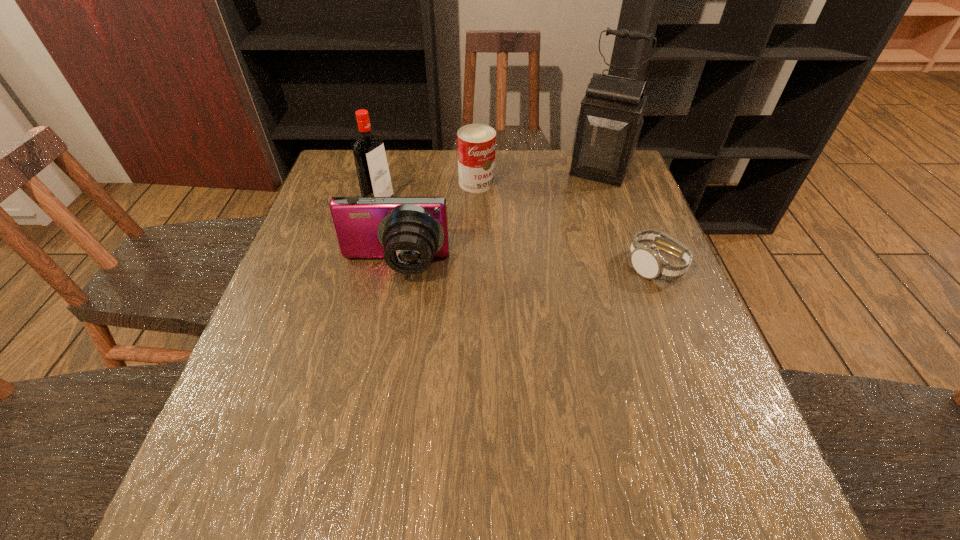
Locate an element on the screen. The width and height of the screenshot is (960, 540). vacant region at the near left corner of the desktop is located at coordinates (264, 434).

Identify the location of free space at the far right corner. Image resolution: width=960 pixels, height=540 pixels. (597, 185).

The height and width of the screenshot is (540, 960). Find the location of `vacant area at the near right corner`. vacant area at the near right corner is located at coordinates (683, 404).

The width and height of the screenshot is (960, 540). I want to click on vacant area between the shortest object and the camera, so click(524, 267).

Locate an element on the screen. The width and height of the screenshot is (960, 540). vacant space that is in between the vodka and the watch is located at coordinates (516, 234).

Find the location of a particular element. Image resolution: width=960 pixels, height=540 pixels. vacant region between the third nearest object and the third object from left to right is located at coordinates (428, 192).

Identify the location of vacant area between the can and the tallest object. pyautogui.click(x=539, y=177).

Identify the location of free spot between the tallest object and the third object from left to right. This screenshot has width=960, height=540. (539, 177).

Find the location of a particular element. The height and width of the screenshot is (540, 960). vacant region between the lantern and the camera is located at coordinates (497, 220).

The width and height of the screenshot is (960, 540). In order to click on vacant space in between the third object from right to left and the second tallest object in this screenshot , I will do `click(428, 192)`.